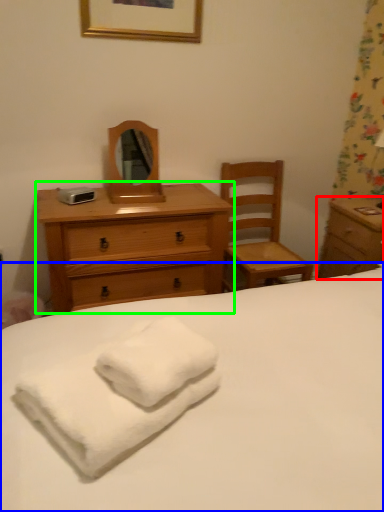
Question: Estimate the real-world distances between objects in this image. Which object is farther from nightstand (highlighted by a red box), bed (highlighted by a blue box) or chest of drawers (highlighted by a green box)?

Choices:
 (A) bed
 (B) chest of drawers

Answer: (A)